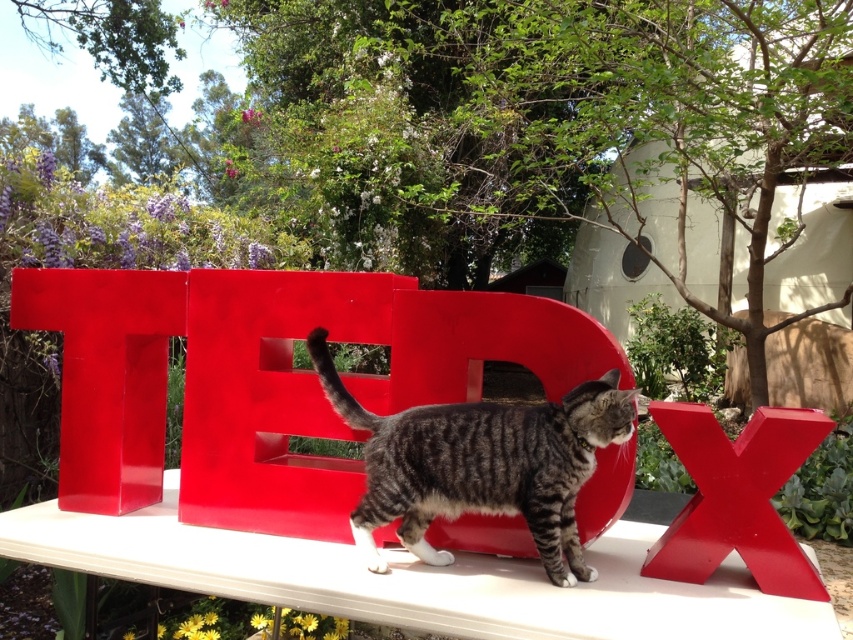
Does tabby fur cat at center appear on the right side of glossy plastic letter t at center?

Yes, tabby fur cat at center is to the right of glossy plastic letter t at center.

Does point (447, 406) lie behind point (32, 301)?

No, it is not.

At what (x,y) coordinates should I click in order to perform the action: click on tabby fur cat at center. Please return your answer as a coordinate pair (x, y). The height and width of the screenshot is (640, 853). Looking at the image, I should click on (480, 464).

Is white glossy park bench at center shorter than tabby fur cat at center?

In fact, white glossy park bench at center may be taller than tabby fur cat at center.

Does point (154, 317) come behind point (390, 515)?

Yes, it is.

Between point (434, 582) and point (489, 419), which one is positioned in front?

Positioned in front is point (434, 582).

The image size is (853, 640). I want to click on white glossy park bench at center, so click(x=339, y=461).

Can you confirm if tabby fur cat at center is smaller than glossy plastic x at right?

Incorrect, tabby fur cat at center is not smaller in size than glossy plastic x at right.

Who is shorter, tabby fur cat at center or glossy plastic x at right?

Standing shorter between the two is glossy plastic x at right.

At what (x,y) coordinates should I click in order to perform the action: click on tabby fur cat at center. Please return your answer as a coordinate pair (x, y). This screenshot has height=640, width=853. Looking at the image, I should click on (480, 464).